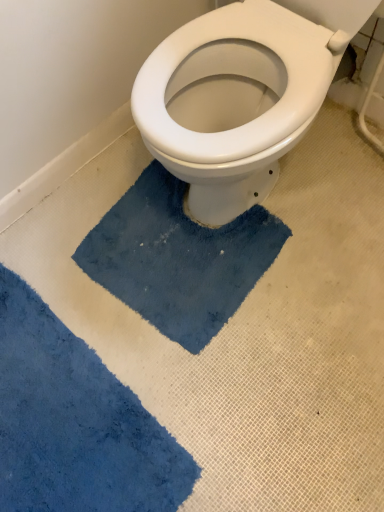
Image resolution: width=384 pixels, height=512 pixels. I want to click on vacant area that lies between blue soft rug at lower left, the second bath mat positioned from the top, and blue plush bath mat at center, which is the first bath mat in top-to-bottom order, so click(x=139, y=316).